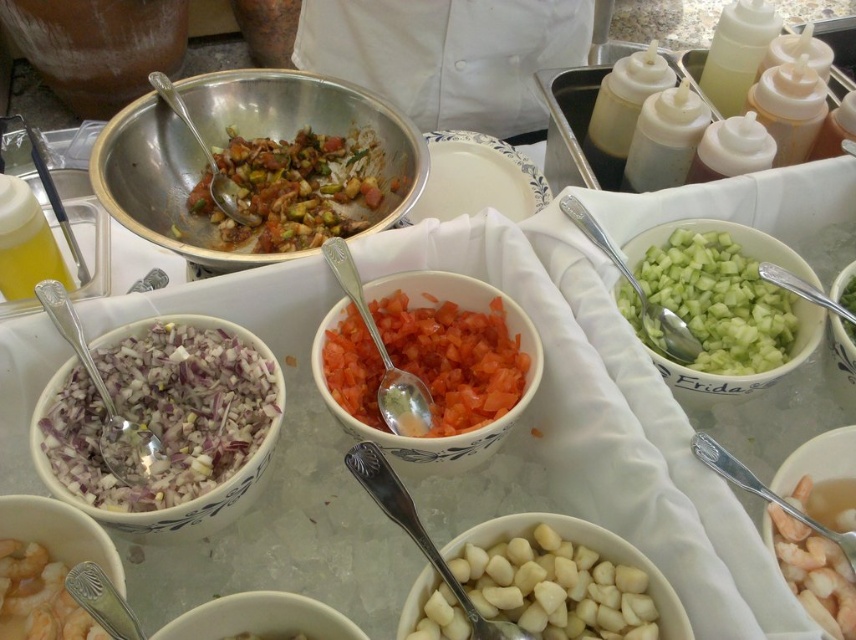
Question: Is white glossy onion at left above white ceramic bowl at lower right?

Choices:
 (A) no
 (B) yes

Answer: (B)

Question: Estimate the real-world distances between objects in this image. Which object is closer to the white paper plate at center?

Choices:
 (A) green translucent bowl at center right
 (B) tomato-based mixture at center

Answer: (B)

Question: Which object appears closest to the camera in this image?

Choices:
 (A) chopped tomato bowl at center
 (B) green translucent bowl at center right
 (C) white ceramic bowl at lower left
 (D) white glossy garlic at center

Answer: (D)

Question: Is white paper plate at center closer to camera compared to green matte cucumber at center right?

Choices:
 (A) yes
 (B) no

Answer: (B)

Question: Among these objects, which one is farthest from the camera?

Choices:
 (A) green translucent bowl at center right
 (B) green leafy vegetable at center
 (C) green matte cucumber at center right
 (D) white glossy onion at left

Answer: (B)

Question: Is white paper plate at center further to the viewer compared to green leafy vegetable at center?

Choices:
 (A) yes
 (B) no

Answer: (A)